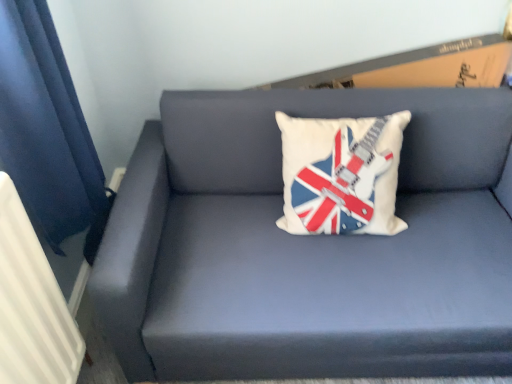
What do you see at coordinates (308, 246) in the screenshot? This screenshot has height=384, width=512. I see `matte blue couch at center` at bounding box center [308, 246].

Locate an element on the screen. The image size is (512, 384). white fabric pillow with guitar and flag design at center is located at coordinates (341, 174).

Is matte blue couch at center completely or partially outside of white textured radiator at left?

Yes.

Can you confirm if matte blue couch at center is wider than white textured radiator at left?

Indeed, matte blue couch at center has a greater width compared to white textured radiator at left.

Which is in front, matte blue couch at center or white textured radiator at left?

white textured radiator at left is in front.

Considering the positions of objects matte blue couch at center and white textured radiator at left in the image provided, who is more to the left, matte blue couch at center or white textured radiator at left?

Positioned to the left is white textured radiator at left.

The image size is (512, 384). I want to click on radiator that is under the white fabric pillow with guitar and flag design at center (from a real-world perspective), so click(32, 305).

In the scene shown: How much distance is there between white textured radiator at left and white fabric pillow with guitar and flag design at center?

They are 31.74 inches apart.

Which is farther from the camera, (60, 301) or (296, 132)?

The point (296, 132) is more distant.

Is matte blue couch at center positioned with its back to white fabric pillow with guitar and flag design at center?

Yes, matte blue couch at center's orientation is away from white fabric pillow with guitar and flag design at center.

Between matte blue couch at center and white fabric pillow with guitar and flag design at center, which one has less height?

Standing shorter between the two is white fabric pillow with guitar and flag design at center.

Is point (401, 271) farther from camera compared to point (385, 131)?

That is False.

Can you confirm if matte blue couch at center is smaller than white fabric pillow with guitar and flag design at center?

Incorrect, matte blue couch at center is not smaller in size than white fabric pillow with guitar and flag design at center.

Could white textured radiator at left be considered to be inside white fabric pillow with guitar and flag design at center?

No, white textured radiator at left is not a part of white fabric pillow with guitar and flag design at center.

From the image's perspective, which is above, white fabric pillow with guitar and flag design at center or white textured radiator at left?

white fabric pillow with guitar and flag design at center appears higher in the image.

Who is taller, white fabric pillow with guitar and flag design at center or white textured radiator at left?

white textured radiator at left.

Considering the relative sizes of white textured radiator at left and matte blue couch at center in the image provided, is white textured radiator at left thinner than matte blue couch at center?

Correct, the width of white textured radiator at left is less than that of matte blue couch at center.

Considering the sizes of objects white textured radiator at left and matte blue couch at center in the image provided, who is bigger, white textured radiator at left or matte blue couch at center?

matte blue couch at center.

From the picture: Is white textured radiator at left looking in the opposite direction of matte blue couch at center?

No, matte blue couch at center is not at the back of white textured radiator at left.

Between white textured radiator at left and matte blue couch at center, which one has less height?

matte blue couch at center.

Are white fabric pillow with guitar and flag design at center and matte blue couch at center far apart?

Actually, white fabric pillow with guitar and flag design at center and matte blue couch at center are a little close together.

Image resolution: width=512 pixels, height=384 pixels. I want to click on studio couch that appears below the white fabric pillow with guitar and flag design at center (from a real-world perspective), so click(308, 246).

Can matte blue couch at center be found inside white fabric pillow with guitar and flag design at center?

No, matte blue couch at center is not surrounded by white fabric pillow with guitar and flag design at center.

You are a GUI agent. You are given a task and a screenshot of the screen. Output one action in this format:
    pyautogui.click(x=<x>, y=<y>)
    Task: Click on the radiator in front of the matte blue couch at center
    This screenshot has width=512, height=384.
    Given the screenshot: What is the action you would take?
    pyautogui.click(x=32, y=305)

I want to click on pillow that appears above the white textured radiator at left (from a real-world perspective), so click(341, 174).

Which object lies further to the anchor point matte blue couch at center, white textured radiator at left or white fabric pillow with guitar and flag design at center?

The object further to matte blue couch at center is white textured radiator at left.

Considering their positions, is white textured radiator at left positioned further to white fabric pillow with guitar and flag design at center than matte blue couch at center?

A: Among the two, white textured radiator at left is located further to white fabric pillow with guitar and flag design at center.

From the image, which object appears to be nearer to matte blue couch at center, white fabric pillow with guitar and flag design at center or white textured radiator at left?

white fabric pillow with guitar and flag design at center lies closer to matte blue couch at center than the other object.

Looking at the image, which one is located further to white fabric pillow with guitar and flag design at center, matte blue couch at center or white textured radiator at left?

white textured radiator at left.

Estimate the real-world distances between objects in this image. Which object is closer to white textured radiator at left, white fabric pillow with guitar and flag design at center or matte blue couch at center?

matte blue couch at center is closer to white textured radiator at left.

Which object lies nearer to the anchor point white textured radiator at left, matte blue couch at center or white fabric pillow with guitar and flag design at center?

The object closer to white textured radiator at left is matte blue couch at center.

Locate an element on the screen. pillow between white textured radiator at left and matte blue couch at center is located at coordinates (341, 174).